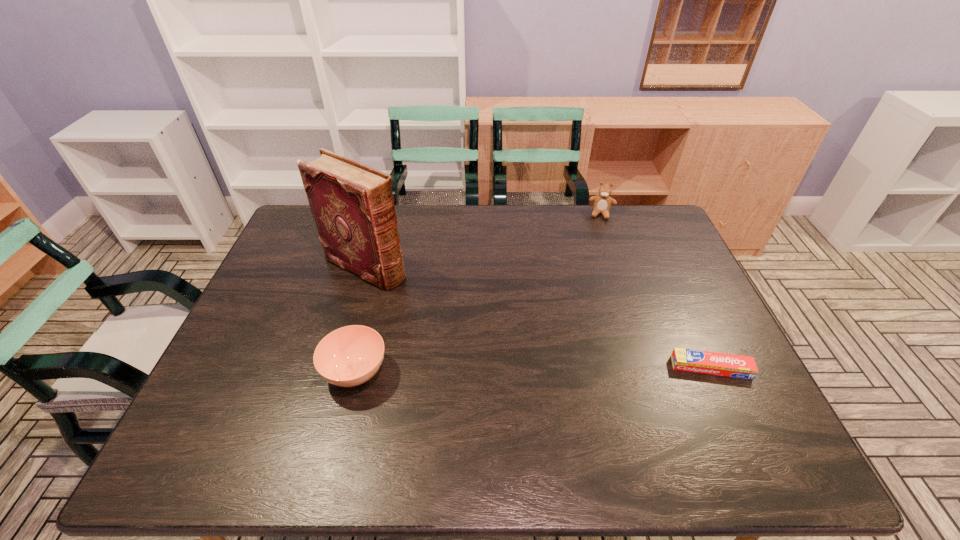
The height and width of the screenshot is (540, 960). I want to click on vacant space on the desktop that is between the third tallest object and the toothpaste and is positioned on the spine side of the hardback book, so click(x=564, y=369).

In order to click on free space on the desktop that is between the second shortest object and the toothpaste and is positioned on the front-facing side of the farthest object in this screenshot , I will do `click(583, 369)`.